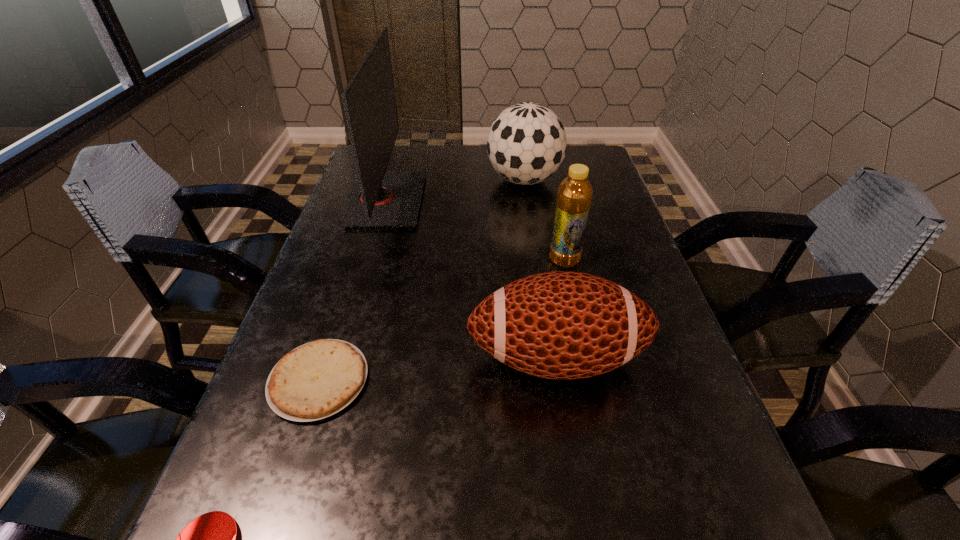
I want to click on blank space at the left edge, so click(x=243, y=524).

Find the location of a particular element. The height and width of the screenshot is (540, 960). vacant space at the right edge of the desktop is located at coordinates (611, 209).

In the image, there is a desktop. Identify the location of free region at the far right corner. (576, 146).

You are a GUI agent. You are given a task and a screenshot of the screen. Output one action in this format:
    pyautogui.click(x=<x>, y=<y>)
    Task: Click on the vacant area between the soccer ball and the tortilla
    
    Given the screenshot: What is the action you would take?
    pyautogui.click(x=421, y=280)

You are a GUI agent. You are given a task and a screenshot of the screen. Output one action in this format:
    pyautogui.click(x=<x>, y=<y>)
    Task: Click on the vacant region between the tortilla and the soccer ball
    Image resolution: width=960 pixels, height=540 pixels.
    Given the screenshot: What is the action you would take?
    pyautogui.click(x=421, y=280)

The width and height of the screenshot is (960, 540). Find the location of `vacant space that is in between the tallest object and the bottle`. vacant space that is in between the tallest object and the bottle is located at coordinates (475, 230).

Locate an element on the screen. The height and width of the screenshot is (540, 960). free space that is in between the tallest object and the bottle is located at coordinates (475, 230).

Identify which object is the fourth closest to the tallest object. Please provide its 2D coordinates. Your answer should be formatted as a tuple, i.e. [(x, y)], where the tuple contains the x and y coordinates of a point satisfying the conditions above.

[(574, 198)]

Where is `object that is the fourth closest one to the soccer ball`? object that is the fourth closest one to the soccer ball is located at coordinates (316, 380).

This screenshot has width=960, height=540. What are the coordinates of `blank area in the image that satisfies the following two spatial constraints: 1. on the front side of the soccer ball; 2. on the screen side of the tallest object` in the screenshot? It's located at (527, 200).